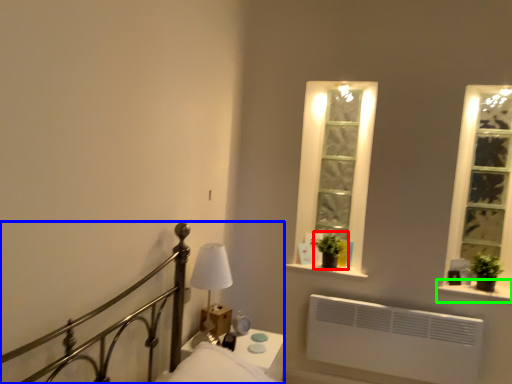
Question: Which object is the closest to the plant (highlighted by a red box)? Choose among these: bed (highlighted by a blue box) or window sill (highlighted by a green box).

Choices:
 (A) bed
 (B) window sill

Answer: (B)